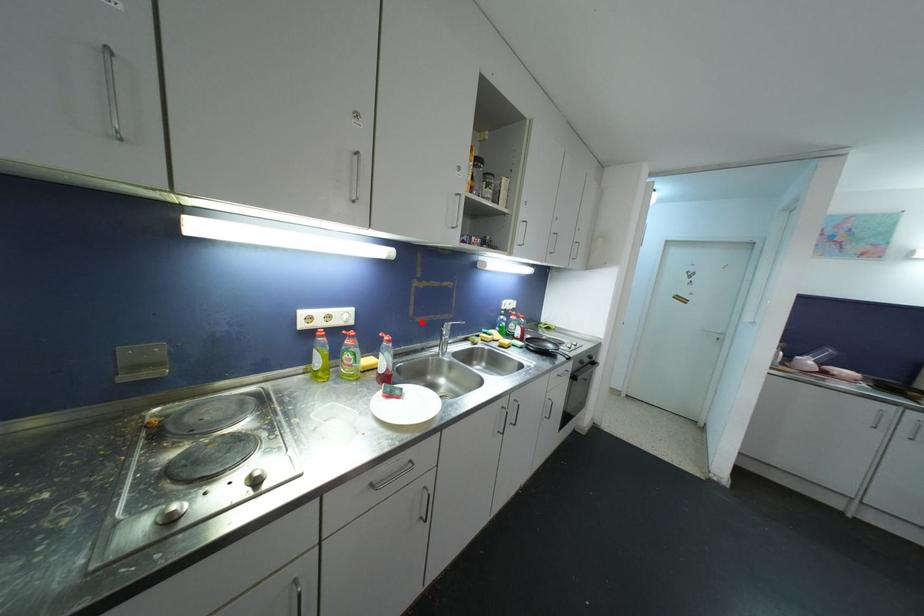
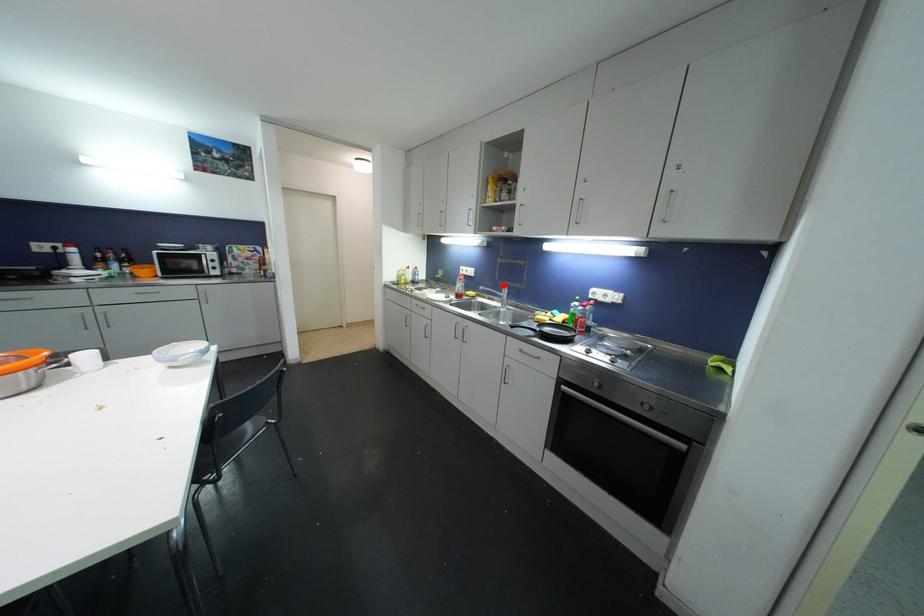
I am providing you with two images of the same scene from different viewpoints. A red point is marked on the first image and another point is marked on the second image. Are the points marked in image1 and image2 representing the same 3D position?

Yes